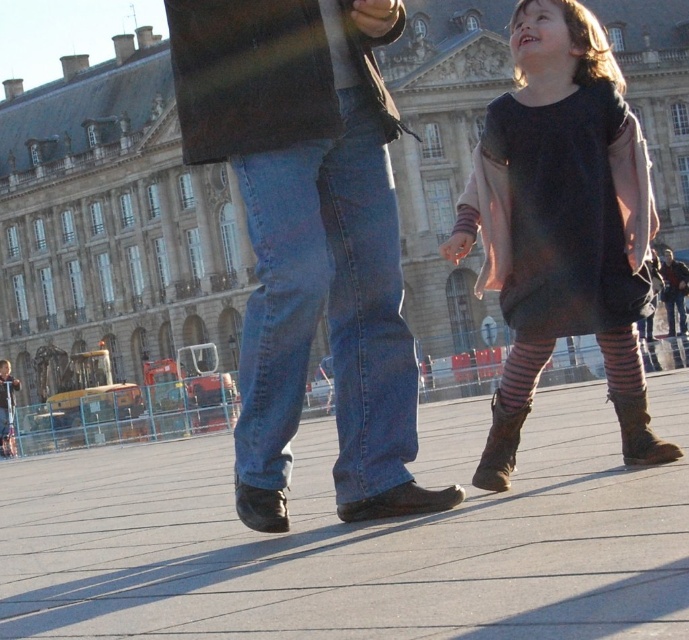
Based on the photo, you are standing in the plaza and see the blue denim jeans at center and the striped fabric sock at lower right. Which object is nearer to you?

The blue denim jeans at center is closer to the viewer than the striped fabric sock at lower right.